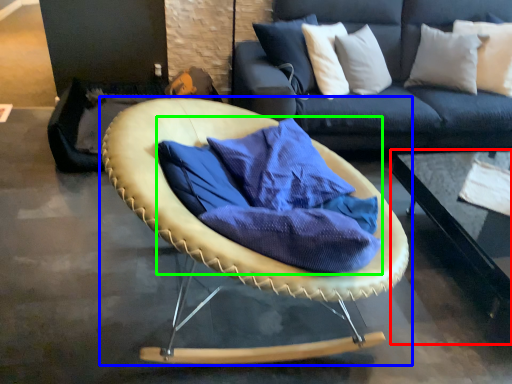
Question: Which object is the farthest from table (highlighted by a red box)? Choose among these: chair (highlighted by a blue box) or fabric (highlighted by a green box).

Choices:
 (A) chair
 (B) fabric

Answer: (A)